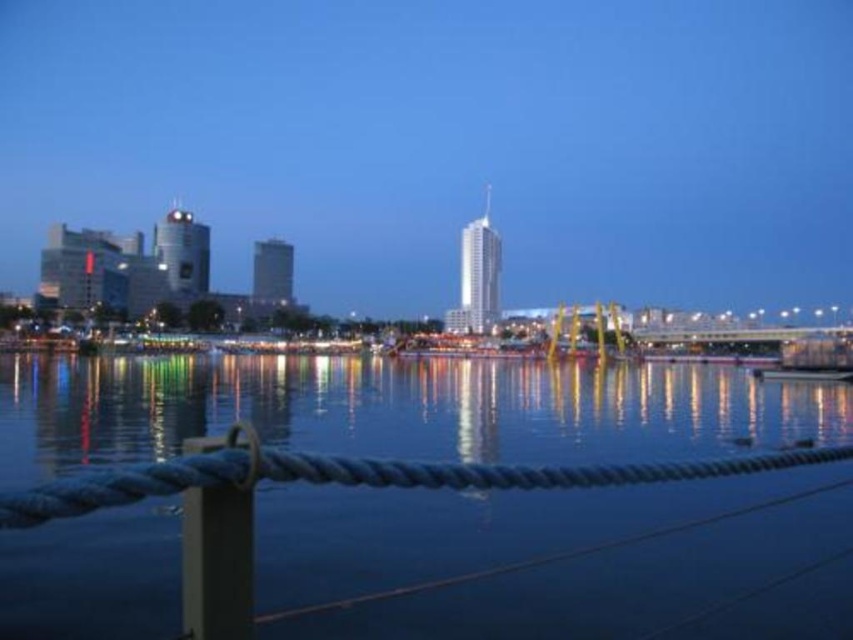
You are a photographer trying to capture the waterfront scene. You notice the dark blue water at center and the metallic gray pole at lower left. Which object should you focus on to ensure it takes up more space in your photo?

The dark blue water at center should be focused on since it is bigger than the metallic gray pole at lower left, ensuring it occupies more space in the photo.

You are standing on the dock and want to know the exact location of the dark blue water at center. According to the coordinates provided, where is it positioned?

The dark blue water at center is located at point 0.641 on the x axis and 0.469 on the y axis.

You are standing on a dock and see the dark blue water at center and the metallic gray pole at lower left. Which object is closer to your feet?

The metallic gray pole at lower left is closer to your feet because it is positioned above the dark blue water at center.